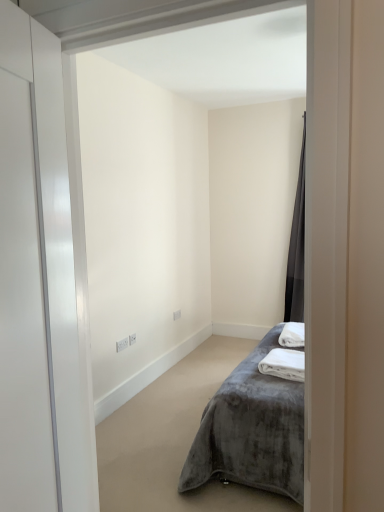
Question: Considering the relative positions of dark gray velvet curtain at right and velvet grey bed at center in the image provided, is dark gray velvet curtain at right behind velvet grey bed at center?

Choices:
 (A) yes
 (B) no

Answer: (A)

Question: Would you say dark gray velvet curtain at right contains velvet grey bed at center?

Choices:
 (A) yes
 (B) no

Answer: (B)

Question: Does dark gray velvet curtain at right have a greater width compared to velvet grey bed at center?

Choices:
 (A) yes
 (B) no

Answer: (B)

Question: Can you confirm if dark gray velvet curtain at right is positioned to the right of velvet grey bed at center?

Choices:
 (A) yes
 (B) no

Answer: (A)

Question: Is velvet grey bed at center at the back of dark gray velvet curtain at right?

Choices:
 (A) yes
 (B) no

Answer: (B)

Question: From the image's perspective, relative to white soft towel at lower right, positioned as the second bath towel in back-to-front order, is dark gray velvet curtain at right above or below?

Choices:
 (A) above
 (B) below

Answer: (A)

Question: Is dark gray velvet curtain at right wider or thinner than white soft towel at lower right, positioned as the second bath towel in back-to-front order?

Choices:
 (A) thin
 (B) wide

Answer: (B)

Question: In the image, is dark gray velvet curtain at right positioned in front of or behind white soft towel at lower right, the 1th bath towel from the front?

Choices:
 (A) behind
 (B) front

Answer: (A)

Question: Is dark gray velvet curtain at right spatially inside white soft towel at lower right, the 1th bath towel from the front, or outside of it?

Choices:
 (A) inside
 (B) outside

Answer: (B)

Question: Is dark gray velvet curtain at right wider or thinner than white plush bath towel at lower right, the first bath towel positioned from the back?

Choices:
 (A) thin
 (B) wide

Answer: (B)

Question: Is dark gray velvet curtain at right spatially inside white plush bath towel at lower right, the first bath towel positioned from the back, or outside of it?

Choices:
 (A) outside
 (B) inside

Answer: (A)

Question: From a real-world perspective, is dark gray velvet curtain at right above or below white plush bath towel at lower right, the 2th bath towel positioned from the front?

Choices:
 (A) above
 (B) below

Answer: (A)

Question: Considering their positions, is dark gray velvet curtain at right located in front of or behind white plush bath towel at lower right, the first bath towel positioned from the back?

Choices:
 (A) front
 (B) behind

Answer: (B)

Question: Is white soft towel at lower right, positioned as the second bath towel in back-to-front order, bigger or smaller than velvet grey bed at center?

Choices:
 (A) big
 (B) small

Answer: (B)

Question: In terms of height, does white soft towel at lower right, the 1th bath towel from the front, look taller or shorter compared to velvet grey bed at center?

Choices:
 (A) short
 (B) tall

Answer: (A)